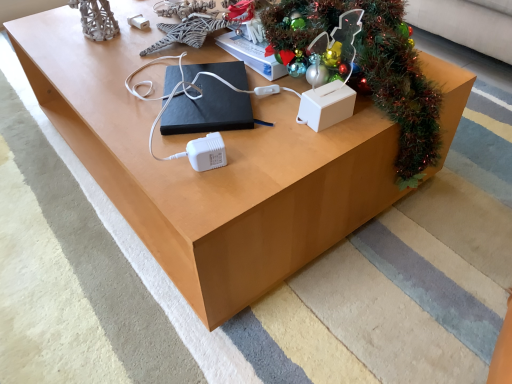
The height and width of the screenshot is (384, 512). I want to click on vacant space that's between black matte book at center and white plastic tissue box at center-right, so click(271, 105).